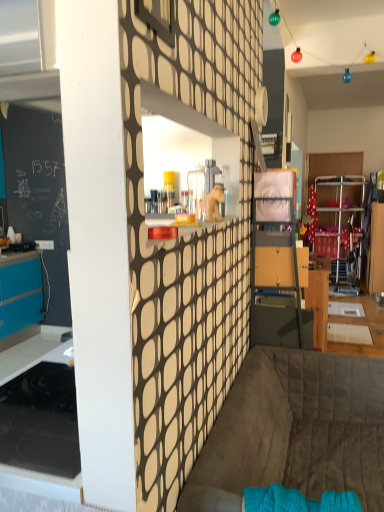
Question: From a real-world perspective, is dark gray quilted couch at lower center positioned above or below matte glass window at upper center?

Choices:
 (A) below
 (B) above

Answer: (A)

Question: Looking at their shapes, would you say dark gray quilted couch at lower center is wider or thinner than matte glass window at upper center?

Choices:
 (A) thin
 (B) wide

Answer: (B)

Question: Which object is the farthest from the wooden drawer at center?

Choices:
 (A) matte glass window at upper center
 (B) dark gray quilted couch at lower center

Answer: (A)

Question: Estimate the real-world distances between objects in this image. Which object is closer to the matte glass window at upper center?

Choices:
 (A) dark gray quilted couch at lower center
 (B) wooden drawer at center

Answer: (A)